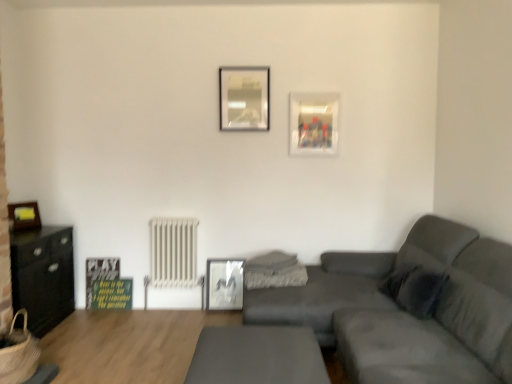
How much space does matte plastic picture frame at upper right, the 2th picture frame in the top-to-bottom sequence, occupy vertically?

matte plastic picture frame at upper right, the 2th picture frame in the top-to-bottom sequence, is 21.69 inches tall.

The image size is (512, 384). Describe the element at coordinates (244, 98) in the screenshot. I see `metallic silver picture frame at upper center, which is counted as the 3th picture frame, starting from the left` at that location.

What do you see at coordinates (224, 284) in the screenshot? I see `metallic silver picture frame at center, positioned as the 1th picture frame in bottom-to-top order` at bounding box center [224, 284].

How much space does matte black picture frame at left, which is the first picture frame from left to right, occupy horizontally?

2.81 inches.

Find the location of a particular element. matte black picture frame at left, positioned as the 4th picture frame in right-to-left order is located at coordinates (24, 216).

This screenshot has height=384, width=512. In order to click on smooth gray table at center in this screenshot , I will do `click(257, 356)`.

Which of these two, matte gray couch at center or matte black picture frame at left, which is the second picture frame from bottom to top, is smaller?

matte black picture frame at left, which is the second picture frame from bottom to top.

Is point (495, 296) closer or farther from the camera than point (13, 208)?

Clearly, point (495, 296) is closer to the camera than point (13, 208).

Is matte black picture frame at left, which is the second picture frame from bottom to top, a part of matte gray couch at center?

No, matte black picture frame at left, which is the second picture frame from bottom to top, is not surrounded by matte gray couch at center.

Does metallic silver picture frame at center, the 4th picture frame from the top, come behind matte gray couch at center?

Yes, metallic silver picture frame at center, the 4th picture frame from the top, is further from the camera.

From the image's perspective, is metallic silver picture frame at center, the 4th picture frame from the top, positioned above or below matte gray couch at center?

metallic silver picture frame at center, the 4th picture frame from the top, is below matte gray couch at center.

Considering the relative positions of metallic silver picture frame at center, positioned as the 1th picture frame in bottom-to-top order, and matte gray couch at center in the image provided, is metallic silver picture frame at center, positioned as the 1th picture frame in bottom-to-top order, to the left or to the right of matte gray couch at center?

In the image, metallic silver picture frame at center, positioned as the 1th picture frame in bottom-to-top order, appears on the left side of matte gray couch at center.

You are a GUI agent. You are given a task and a screenshot of the screen. Output one action in this format:
    pyautogui.click(x=<x>, y=<y>)
    Task: Click on the picture frame below the matte gray couch at center (from a real-world perspective)
    
    Given the screenshot: What is the action you would take?
    pyautogui.click(x=224, y=284)

Considering the sizes of braided straw basket at lower left and matte plastic picture frame at upper right, the 4th picture frame viewed from the left, in the image, is braided straw basket at lower left bigger or smaller than matte plastic picture frame at upper right, the 4th picture frame viewed from the left,?

Considering their sizes, braided straw basket at lower left takes up more space than matte plastic picture frame at upper right, the 4th picture frame viewed from the left.

Is braided straw basket at lower left positioned with its back to matte plastic picture frame at upper right, which appears as the 3th picture frame when ordered from the bottom?

braided straw basket at lower left does not have its back to matte plastic picture frame at upper right, which appears as the 3th picture frame when ordered from the bottom.

What are the coordinates of `basket to the left of matte plastic picture frame at upper right, placed as the first picture frame when sorted from right to left` in the screenshot? It's located at (19, 354).

Consider the image. From the image's perspective, which is below, braided straw basket at lower left or black matte cabinet at left?

braided straw basket at lower left appears lower in the image.

Looking at this image, can you tell me how much braided straw basket at lower left and black matte cabinet at left differ in facing direction?

The angle between the facing direction of braided straw basket at lower left and the facing direction of black matte cabinet at left is 0.0403 degrees.

Is braided straw basket at lower left far away from black matte cabinet at left?

No, braided straw basket at lower left is not far from black matte cabinet at left.

Which is more to the left, braided straw basket at lower left or black matte cabinet at left?

From the viewer's perspective, black matte cabinet at left appears more on the left side.

Which of these two, white metallic radiator at center-left or matte plastic picture frame at upper right, the 4th picture frame viewed from the left, is bigger?

With larger size is white metallic radiator at center-left.

Between white metallic radiator at center-left and matte plastic picture frame at upper right, the 2th picture frame in the top-to-bottom sequence, which one is positioned in front?

matte plastic picture frame at upper right, the 2th picture frame in the top-to-bottom sequence, is more forward.

Is white metallic radiator at center-left touching matte plastic picture frame at upper right, the 4th picture frame viewed from the left?

There is a gap between white metallic radiator at center-left and matte plastic picture frame at upper right, the 4th picture frame viewed from the left.

From a real-world perspective, relative to metallic silver picture frame at center, the 4th picture frame from the top, is braided straw basket at lower left vertically above or below?

braided straw basket at lower left is situated higher than metallic silver picture frame at center, the 4th picture frame from the top, in the real world.

Consider the image. Which point is more distant from viewer, (36, 354) or (234, 275)?

A: The point (234, 275) is behind.

Is braided straw basket at lower left closer to the viewer compared to metallic silver picture frame at center, the 4th picture frame from the top?

That is True.

Would you say metallic silver picture frame at center, the 4th picture frame from the top, is part of braided straw basket at lower left's contents?

No, metallic silver picture frame at center, the 4th picture frame from the top, is not surrounded by braided straw basket at lower left.

Would you say smooth gray table at center is to the left or to the right of white metallic radiator at center-left in the picture?

From the image, it's evident that smooth gray table at center is to the right of white metallic radiator at center-left.

From a real-world perspective, is smooth gray table at center over white metallic radiator at center-left?

Incorrect, from a real-world perspective, smooth gray table at center is lower than white metallic radiator at center-left.

Who is smaller, smooth gray table at center or white metallic radiator at center-left?

white metallic radiator at center-left.

Where is `the 4th picture frame to the left of the matte gray couch at center, counting from the anchor's position`? The image size is (512, 384). the 4th picture frame to the left of the matte gray couch at center, counting from the anchor's position is located at coordinates (24, 216).

Locate an element on the screen. The height and width of the screenshot is (384, 512). picture frame that appears below the matte gray couch at center (from a real-world perspective) is located at coordinates (224, 284).

Considering their positions, is black matte cabinet at left positioned closer to matte plastic picture frame at upper right, the 4th picture frame viewed from the left, than matte gray couch at center?

matte gray couch at center is closer to matte plastic picture frame at upper right, the 4th picture frame viewed from the left.

From the image, which object appears to be nearer to metallic silver picture frame at upper center, which is counted as the 3th picture frame, starting from the left, smooth gray table at center or braided straw basket at lower left?

Among the two, smooth gray table at center is located nearer to metallic silver picture frame at upper center, which is counted as the 3th picture frame, starting from the left.

Which object lies nearer to the anchor point black matte cabinet at left, smooth gray table at center or matte gray couch at center?

smooth gray table at center lies closer to black matte cabinet at left than the other object.

Estimate the real-world distances between objects in this image. Which object is closer to white metallic radiator at center-left, matte plastic picture frame at upper right, placed as the first picture frame when sorted from right to left, or matte black picture frame at left, placed as the third picture frame when sorted from top to bottom?

matte black picture frame at left, placed as the third picture frame when sorted from top to bottom, is positioned closer to the anchor white metallic radiator at center-left.

Considering their positions, is matte plastic picture frame at upper right, which appears as the 3th picture frame when ordered from the bottom, positioned closer to metallic silver picture frame at upper center, which is the fourth picture frame in bottom-to-top order, than black matte cabinet at left?

Among the two, matte plastic picture frame at upper right, which appears as the 3th picture frame when ordered from the bottom, is located nearer to metallic silver picture frame at upper center, which is the fourth picture frame in bottom-to-top order.

Based on their spatial positions, is matte gray couch at center or metallic silver picture frame at upper center, which is counted as the 3th picture frame, starting from the left, further from matte plastic picture frame at upper right, the 4th picture frame viewed from the left?

The object further to matte plastic picture frame at upper right, the 4th picture frame viewed from the left, is matte gray couch at center.

In the scene shown: Considering their positions, is black matte cabinet at left positioned further to metallic silver picture frame at upper center, which is the first picture frame in top-to-bottom order, than braided straw basket at lower left?

braided straw basket at lower left is further to metallic silver picture frame at upper center, which is the first picture frame in top-to-bottom order.

When comparing their distances from smooth gray table at center, does metallic silver picture frame at center, the 4th picture frame from the top, or white metallic radiator at center-left seem further?

Answer: Among the two, white metallic radiator at center-left is located further to smooth gray table at center.

This screenshot has width=512, height=384. I want to click on entertainment center between metallic silver picture frame at upper center, which is counted as the 3th picture frame, starting from the left, and braided straw basket at lower left, in the vertical direction, so click(42, 275).

At what (x,y) coordinates should I click in order to perform the action: click on basket between matte black picture frame at left, positioned as the 4th picture frame in right-to-left order, and matte plastic picture frame at upper right, placed as the first picture frame when sorted from right to left, in the horizontal direction. Please return your answer as a coordinate pair (x, y). Looking at the image, I should click on (19, 354).

Locate an element on the screen. radiator between matte black picture frame at left, which is the first picture frame from left to right, and metallic silver picture frame at upper center, which is counted as the 3th picture frame, starting from the left, in the horizontal direction is located at coordinates (174, 253).

Locate an element on the screen. studio couch located between smooth gray table at center and white metallic radiator at center-left in the depth direction is located at coordinates (407, 313).